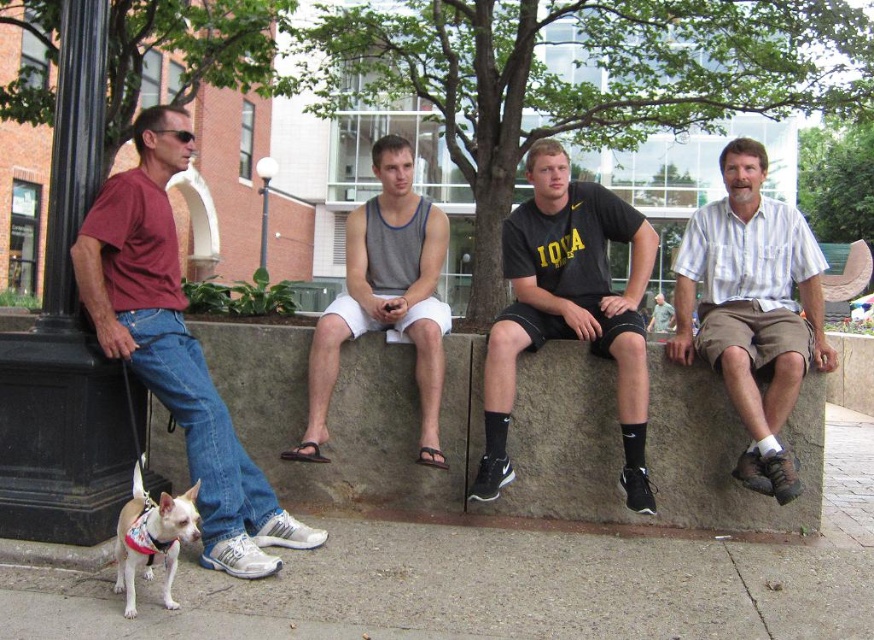
What is the coordinate of the gray concrete at lower left?

The gray concrete at lower left is located at coordinate point (484, 589).